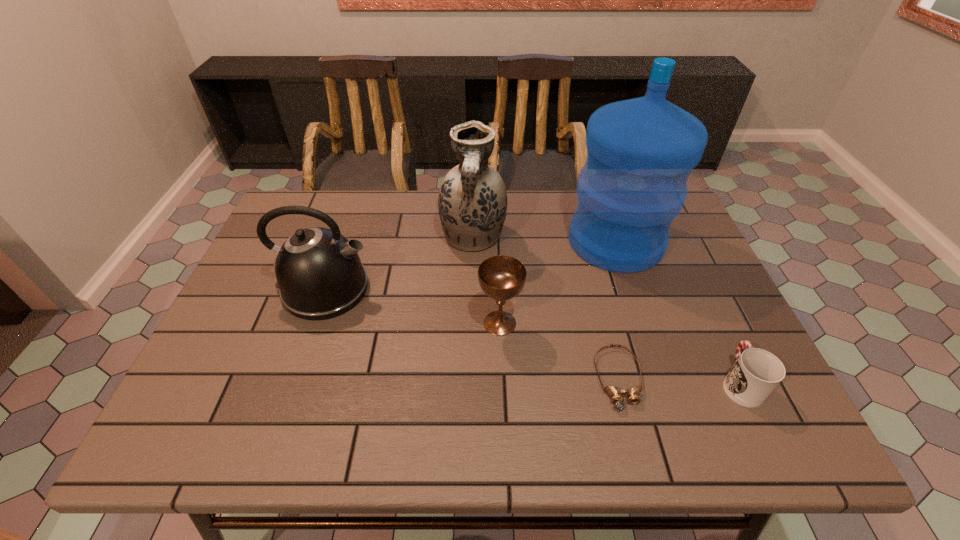
The height and width of the screenshot is (540, 960). I want to click on vacant area between the shortest object and the fourth tallest object, so click(559, 351).

Find the location of a particular element. This screenshot has width=960, height=540. vacant area between the goggles and the water jug is located at coordinates (617, 310).

Where is `empty space that is in between the goggles and the water jug`? empty space that is in between the goggles and the water jug is located at coordinates (617, 310).

I want to click on vacant space in between the second tallest object and the cup, so click(607, 310).

Where is `empty location between the goggles and the third tallest object`? empty location between the goggles and the third tallest object is located at coordinates (472, 334).

I want to click on the second closest object to the goggles, so click(x=756, y=372).

Locate which object ranks second in proximity to the water jug. Please provide its 2D coordinates. Your answer should be formatted as a tuple, i.e. [(x, y)], where the tuple contains the x and y coordinates of a point satisfying the conditions above.

[(501, 277)]

At what (x,y) coordinates should I click in order to perform the action: click on vacant space that satisfies the following two spatial constraints: 1. on the spout of the leftmost object; 2. on the side of the cup where the handle is located. Please return your answer as a coordinate pair (x, y). Looking at the image, I should click on (294, 383).

This screenshot has height=540, width=960. What are the coordinates of `vacant space that satisfies the following two spatial constraints: 1. with the handle on the side of the fifth shortest object; 2. on the left side of the fourth tallest object` in the screenshot? It's located at (471, 323).